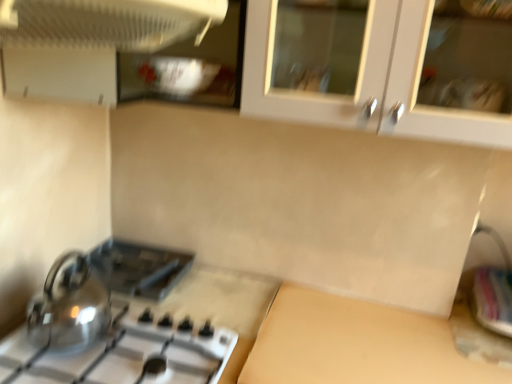
Find the location of a particular element. white plastic fan at upper left, the first kitchen appliance from the front is located at coordinates (106, 22).

The width and height of the screenshot is (512, 384). Describe the element at coordinates (69, 307) in the screenshot. I see `shiny metallic kettle at lower left, which is the 1th kitchen appliance from bottom to top` at that location.

Locate an element on the screen. The image size is (512, 384). shiny metallic kettle at lower left, which is counted as the second kitchen appliance, starting from the front is located at coordinates (69, 307).

Describe the element at coordinates (492, 300) in the screenshot. This screenshot has width=512, height=384. I see `metallic silver sink at lower right` at that location.

The image size is (512, 384). What are the coordinates of `black plastic toaster at lower left` in the screenshot? It's located at (139, 268).

Image resolution: width=512 pixels, height=384 pixels. In order to click on white plastic fan at upper left, the first kitchen appliance from the front in this screenshot , I will do `click(106, 22)`.

Which of these two, beige matte counter top at lower center or shiny metallic gas stove at lower left, is wider?

With larger width is beige matte counter top at lower center.

Based on the photo, which of these two, beige matte counter top at lower center or shiny metallic gas stove at lower left, is bigger?

beige matte counter top at lower center is bigger.

Is beige matte counter top at lower center next to shiny metallic gas stove at lower left?

No, beige matte counter top at lower center is not next to shiny metallic gas stove at lower left.

From the image's perspective, is beige matte counter top at lower center above shiny metallic gas stove at lower left?

No, from the image's perspective, beige matte counter top at lower center is not on top of shiny metallic gas stove at lower left.

Where is `appliance beneath the white plastic fan at upper left, the first kitchen appliance from the front (from a real-world perspective)`? Image resolution: width=512 pixels, height=384 pixels. appliance beneath the white plastic fan at upper left, the first kitchen appliance from the front (from a real-world perspective) is located at coordinates (139, 268).

Can you confirm if white plastic fan at upper left, the 1th kitchen appliance viewed from the top, is positioned to the right of black plastic toaster at lower left?

Yes, white plastic fan at upper left, the 1th kitchen appliance viewed from the top, is to the right of black plastic toaster at lower left.

From a real-world perspective, is white plastic fan at upper left, the first kitchen appliance from the front, physically above black plastic toaster at lower left?

Correct, in the physical world, white plastic fan at upper left, the first kitchen appliance from the front, is higher than black plastic toaster at lower left.

Is there a large distance between white plastic fan at upper left, the first kitchen appliance from the front, and black plastic toaster at lower left?

No, there isn't a large distance between white plastic fan at upper left, the first kitchen appliance from the front, and black plastic toaster at lower left.

Starting from the beige matte counter top at lower center, which kitchen appliance is the 1st one to the left? Please provide its 2D coordinates.

[(106, 22)]

From their relative heights in the image, would you say beige matte counter top at lower center is taller or shorter than white plastic fan at upper left, the 1th kitchen appliance viewed from the top?

Considering their sizes, beige matte counter top at lower center has more height than white plastic fan at upper left, the 1th kitchen appliance viewed from the top.

Is beige matte counter top at lower center spatially inside white plastic fan at upper left, which ranks as the second kitchen appliance in bottom-to-top order, or outside of it?

beige matte counter top at lower center exists outside the volume of white plastic fan at upper left, which ranks as the second kitchen appliance in bottom-to-top order.

From the image's perspective, relative to white plastic fan at upper left, which ranks as the second kitchen appliance in bottom-to-top order, is beige matte counter top at lower center above or below?

beige matte counter top at lower center is situated lower than white plastic fan at upper left, which ranks as the second kitchen appliance in bottom-to-top order, in the image.

From the image's perspective, which one is positioned higher, black plastic toaster at lower left or beige matte counter top at lower center?

From the image's view, black plastic toaster at lower left is above.

Can you confirm if black plastic toaster at lower left is thinner than beige matte counter top at lower center?

Yes, black plastic toaster at lower left is thinner than beige matte counter top at lower center.

Is black plastic toaster at lower left not within beige matte counter top at lower center?

Yes, black plastic toaster at lower left is located beyond the bounds of beige matte counter top at lower center.

Between black plastic toaster at lower left and beige matte counter top at lower center, which one has less height?

Standing shorter between the two is black plastic toaster at lower left.

Can you confirm if shiny metallic kettle at lower left, which is counted as the second kitchen appliance, starting from the front, is wider than black plastic toaster at lower left?

No, shiny metallic kettle at lower left, which is counted as the second kitchen appliance, starting from the front, is not wider than black plastic toaster at lower left.

Based on the photo, is shiny metallic kettle at lower left, which is the 1th kitchen appliance in back-to-front order, in front of or behind black plastic toaster at lower left in the image?

shiny metallic kettle at lower left, which is the 1th kitchen appliance in back-to-front order, is positioned closer to the viewer than black plastic toaster at lower left.

Considering the sizes of shiny metallic kettle at lower left, arranged as the second kitchen appliance when viewed from the top, and black plastic toaster at lower left in the image, is shiny metallic kettle at lower left, arranged as the second kitchen appliance when viewed from the top, taller or shorter than black plastic toaster at lower left?

Clearly, shiny metallic kettle at lower left, arranged as the second kitchen appliance when viewed from the top, is taller compared to black plastic toaster at lower left.

Based on the photo, in terms of size, does shiny metallic kettle at lower left, which is counted as the second kitchen appliance, starting from the front, appear bigger or smaller than black plastic toaster at lower left?

In the image, shiny metallic kettle at lower left, which is counted as the second kitchen appliance, starting from the front, appears to be larger than black plastic toaster at lower left.

Locate an element on the screen. kitchen appliance lying on the left of shiny metallic gas stove at lower left is located at coordinates (69, 307).

Is shiny metallic kettle at lower left, which is the 1th kitchen appliance in back-to-front order, looking in the opposite direction of shiny metallic gas stove at lower left?

No, shiny metallic kettle at lower left, which is the 1th kitchen appliance in back-to-front order, is not facing the opposite direction of shiny metallic gas stove at lower left.

Considering the relative sizes of shiny metallic kettle at lower left, which is the 1th kitchen appliance in back-to-front order, and shiny metallic gas stove at lower left in the image provided, is shiny metallic kettle at lower left, which is the 1th kitchen appliance in back-to-front order, bigger than shiny metallic gas stove at lower left?

No, shiny metallic kettle at lower left, which is the 1th kitchen appliance in back-to-front order, is not bigger than shiny metallic gas stove at lower left.

From the image's perspective, is shiny metallic kettle at lower left, arranged as the second kitchen appliance when viewed from the top, above or below shiny metallic gas stove at lower left?

Clearly, from the image's perspective, shiny metallic kettle at lower left, arranged as the second kitchen appliance when viewed from the top, is above shiny metallic gas stove at lower left.

How many degrees apart are the facing directions of shiny metallic kettle at lower left, which is the 1th kitchen appliance from bottom to top, and metallic silver sink at lower right?

90.7 degrees separate the facing orientations of shiny metallic kettle at lower left, which is the 1th kitchen appliance from bottom to top, and metallic silver sink at lower right.

Considering the relative sizes of shiny metallic kettle at lower left, arranged as the second kitchen appliance when viewed from the top, and metallic silver sink at lower right in the image provided, is shiny metallic kettle at lower left, arranged as the second kitchen appliance when viewed from the top, shorter than metallic silver sink at lower right?

No, shiny metallic kettle at lower left, arranged as the second kitchen appliance when viewed from the top, is not shorter than metallic silver sink at lower right.

At what (x,y) coordinates should I click in order to perform the action: click on sink that is on the right side of shiny metallic kettle at lower left, arranged as the second kitchen appliance when viewed from the top. Please return your answer as a coordinate pair (x, y). Looking at the image, I should click on (492, 300).

Considering the relative sizes of shiny metallic kettle at lower left, which is the 1th kitchen appliance from bottom to top, and metallic silver sink at lower right in the image provided, is shiny metallic kettle at lower left, which is the 1th kitchen appliance from bottom to top, thinner than metallic silver sink at lower right?

Indeed, shiny metallic kettle at lower left, which is the 1th kitchen appliance from bottom to top, has a lesser width compared to metallic silver sink at lower right.

Where is `gas stove above the beige matte counter top at lower center (from the image's perspective)`? gas stove above the beige matte counter top at lower center (from the image's perspective) is located at coordinates (123, 356).

From a real-world perspective, which kitchen appliance is the 2nd one above the black plastic toaster at lower left? Please provide its 2D coordinates.

[(106, 22)]

Based on the photo, considering their positions, is shiny metallic gas stove at lower left positioned further to beige matte counter top at lower center than metallic silver sink at lower right?

metallic silver sink at lower right is further to beige matte counter top at lower center.

Considering their positions, is beige matte counter top at lower center positioned closer to white plastic fan at upper left, which ranks as the second kitchen appliance in bottom-to-top order, than shiny metallic gas stove at lower left?

Among the two, shiny metallic gas stove at lower left is located nearer to white plastic fan at upper left, which ranks as the second kitchen appliance in bottom-to-top order.

Which object lies nearer to the anchor point metallic silver sink at lower right, shiny metallic gas stove at lower left or black plastic toaster at lower left?

shiny metallic gas stove at lower left.

Looking at the image, which one is located closer to beige matte counter top at lower center, shiny metallic gas stove at lower left or white plastic fan at upper left, the first kitchen appliance from the front?

shiny metallic gas stove at lower left.

Considering their positions, is shiny metallic kettle at lower left, which is the 1th kitchen appliance in back-to-front order, positioned further to beige matte counter top at lower center than metallic silver sink at lower right?

Among the two, shiny metallic kettle at lower left, which is the 1th kitchen appliance in back-to-front order, is located further to beige matte counter top at lower center.

Based on the photo, looking at the image, which one is located closer to shiny metallic gas stove at lower left, shiny metallic kettle at lower left, which is counted as the second kitchen appliance, starting from the front, or white plastic fan at upper left, which is the 2th kitchen appliance from back to front?

shiny metallic kettle at lower left, which is counted as the second kitchen appliance, starting from the front, is closer to shiny metallic gas stove at lower left.

Estimate the real-world distances between objects in this image. Which object is further from shiny metallic kettle at lower left, arranged as the second kitchen appliance when viewed from the top, shiny metallic gas stove at lower left or black plastic toaster at lower left?

Among the two, black plastic toaster at lower left is located further to shiny metallic kettle at lower left, arranged as the second kitchen appliance when viewed from the top.

Based on their spatial positions, is black plastic toaster at lower left or shiny metallic kettle at lower left, arranged as the second kitchen appliance when viewed from the top, further from white plastic fan at upper left, which is the 2th kitchen appliance from back to front?

black plastic toaster at lower left is further to white plastic fan at upper left, which is the 2th kitchen appliance from back to front.

Find the location of a particular element. The image size is (512, 384). kitchen appliance located between black plastic toaster at lower left and metallic silver sink at lower right in the left-right direction is located at coordinates (106, 22).

Find the location of a particular element. This screenshot has height=384, width=512. gas stove between black plastic toaster at lower left and beige matte counter top at lower center in the horizontal direction is located at coordinates (123, 356).

Locate an element on the screen. kitchen appliance between white plastic fan at upper left, the 1th kitchen appliance viewed from the top, and beige matte counter top at lower center, in the vertical direction is located at coordinates (69, 307).

Find the location of a particular element. appliance that lies between white plastic fan at upper left, which ranks as the second kitchen appliance in bottom-to-top order, and beige matte counter top at lower center from top to bottom is located at coordinates (139, 268).